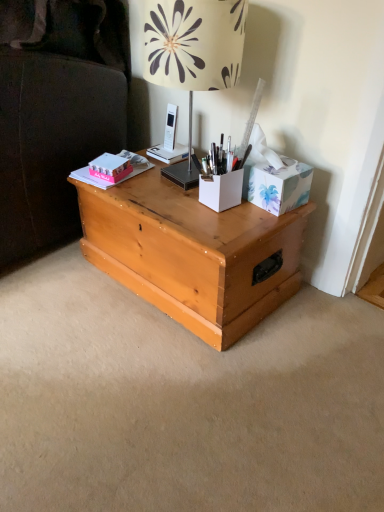
Locate an element on the screen. The image size is (384, 512). vacant space in front of light wood trunk at center is located at coordinates (182, 392).